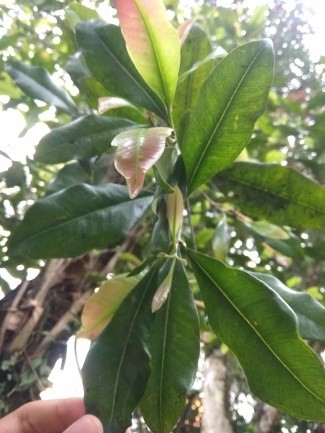
I want to click on plant, so click(x=170, y=195).